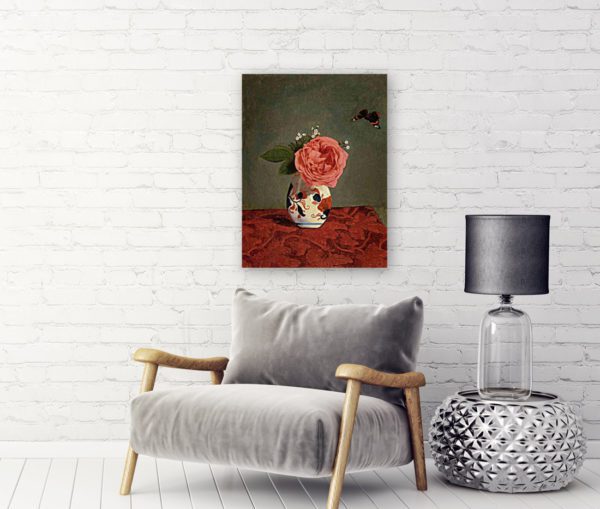
The image size is (600, 509). In order to click on painted white brick wall in this screenshot , I will do `click(104, 276)`.